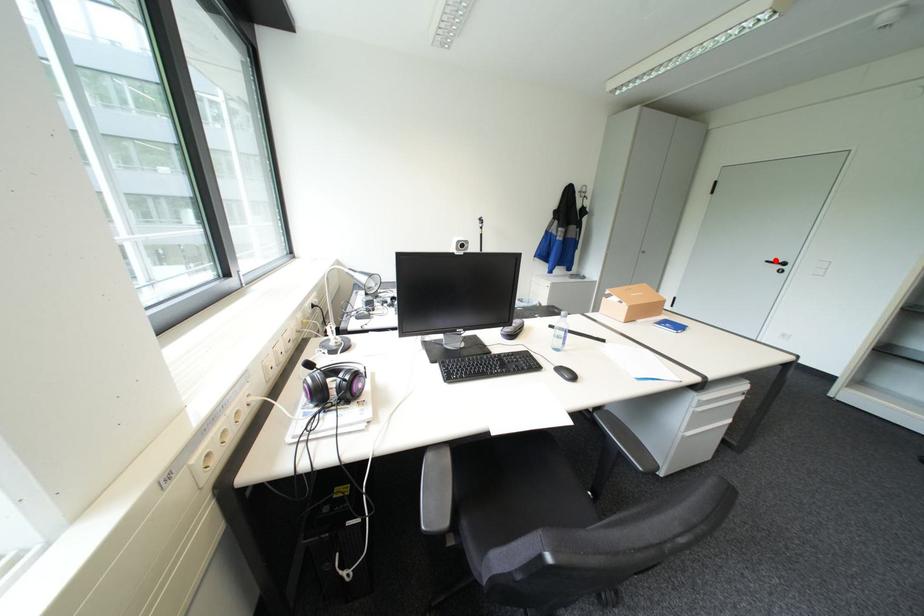
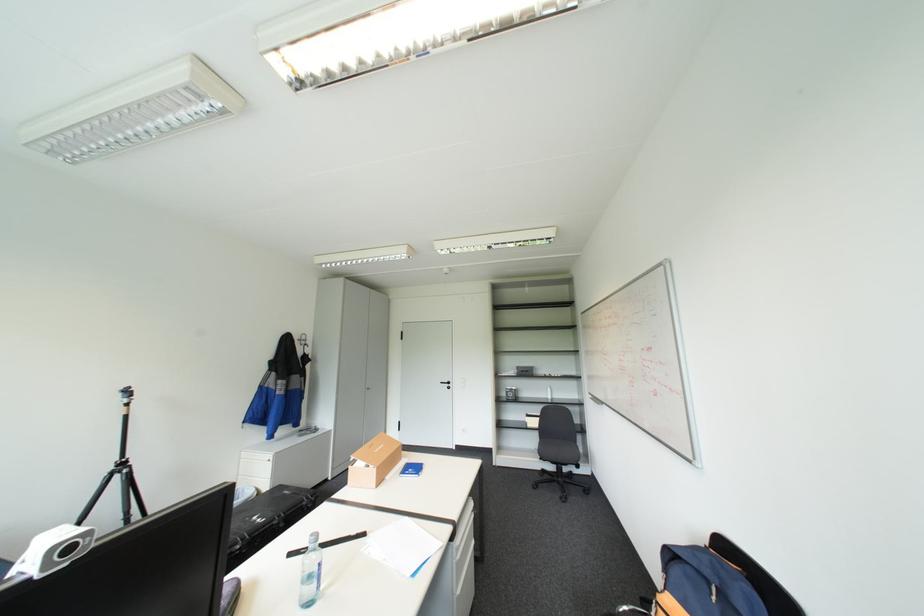
Find the pixel in the second image that matches the highlighted location in the first image.

(450, 381)